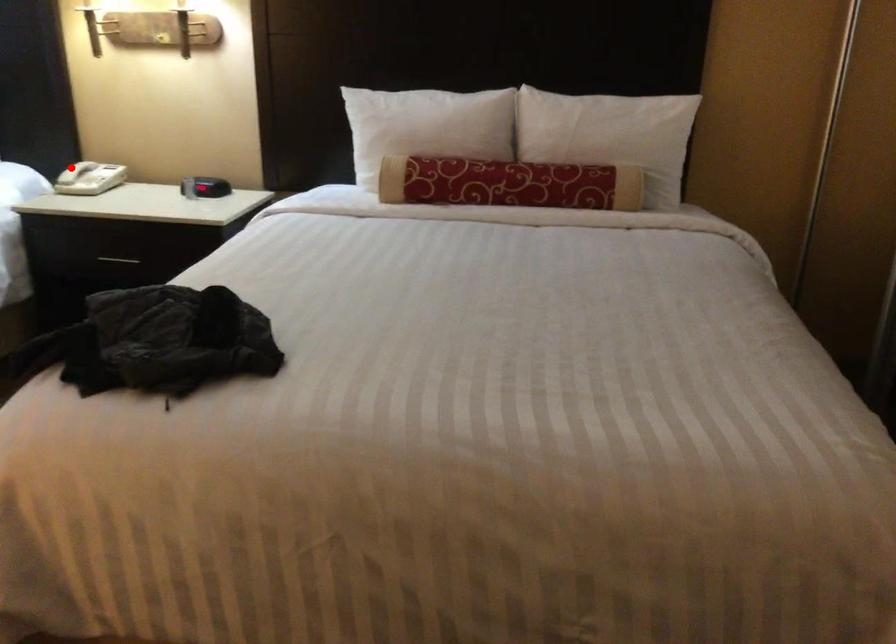
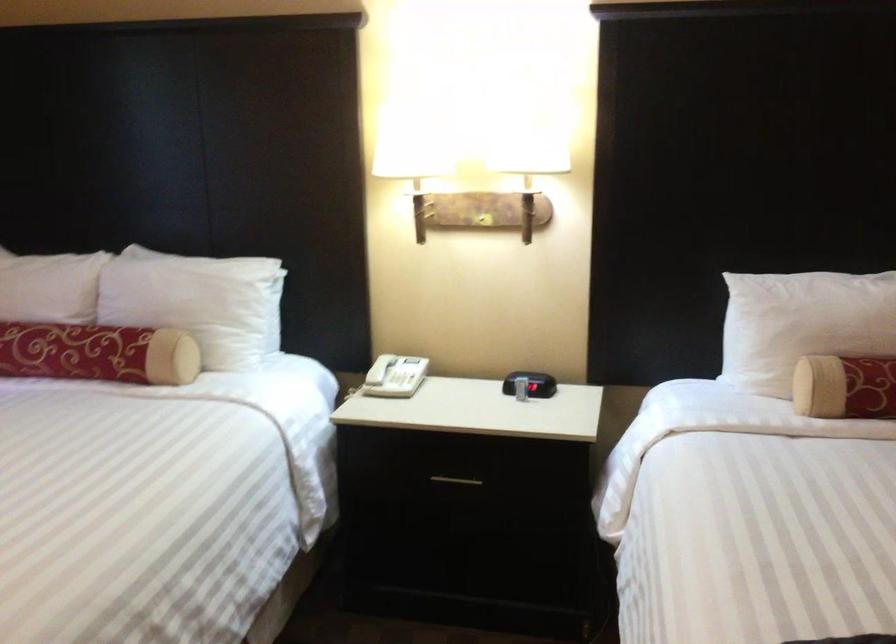
Question: I am providing you with two images of the same scene from different viewpoints. Image1 has a red point marked. In image2, the corresponding 3D location appears at what relative position? Reply with the corresponding letter.

Choices:
 (A) Closer
 (B) Farther

Answer: (A)